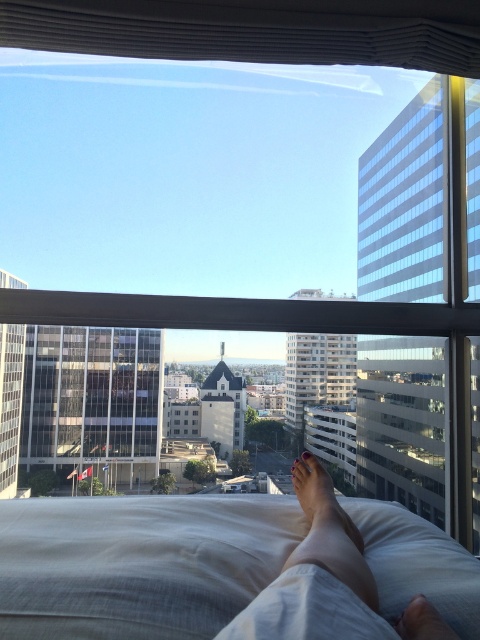
Which is more to the right, white soft pillow at lower center or smooth skin foot at lower center?

smooth skin foot at lower center is more to the right.

You are a GUI agent. You are given a task and a screenshot of the screen. Output one action in this format:
    pyautogui.click(x=<x>, y=<y>)
    Task: Click on the white soft pillow at lower center
    This screenshot has width=480, height=640.
    Given the screenshot: What is the action you would take?
    pyautogui.click(x=139, y=563)

Image resolution: width=480 pixels, height=640 pixels. What do you see at coordinates (139, 563) in the screenshot?
I see `white soft pillow at lower center` at bounding box center [139, 563].

Locate an element on the screen. white soft pillow at lower center is located at coordinates (139, 563).

Which of these two, pink matte foot at lower center or pink matte nail polish at lower center, stands taller?

With more height is pink matte nail polish at lower center.

Does pink matte foot at lower center appear on the left side of pink matte nail polish at lower center?

Correct, you'll find pink matte foot at lower center to the left of pink matte nail polish at lower center.

Is point (332, 541) less distant than point (323, 486)?

That is True.

The width and height of the screenshot is (480, 640). In order to click on pink matte foot at lower center in this screenshot , I will do `click(322, 518)`.

Which is more to the left, skinny white legs at lower center or smooth skin foot at lower center?

Positioned to the left is skinny white legs at lower center.

Which is in front, point (427, 627) or point (436, 618)?

Positioned in front is point (427, 627).

Find the location of a particular element. skinny white legs at lower center is located at coordinates (327, 580).